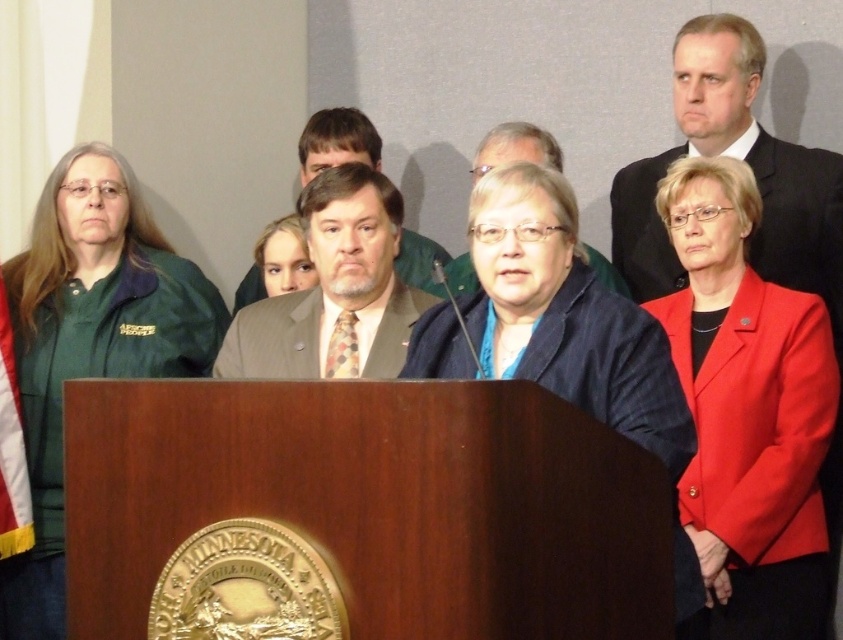
Does point (696, 220) lie in front of point (603, 285)?

No.

Can you confirm if matte red blazer at right is wider than blue fabric jacket at center?

In fact, matte red blazer at right might be narrower than blue fabric jacket at center.

Between point (781, 468) and point (643, 374), which one is positioned behind?

Point (781, 468)

This screenshot has height=640, width=843. What are the coordinates of `matte red blazer at right` in the screenshot? It's located at (747, 410).

Between matte red blazer at right and dark suit at upper right, which one has more height?

matte red blazer at right is taller.

This screenshot has width=843, height=640. What do you see at coordinates (747, 410) in the screenshot?
I see `matte red blazer at right` at bounding box center [747, 410].

The height and width of the screenshot is (640, 843). Find the location of `matte red blazer at right`. matte red blazer at right is located at coordinates (747, 410).

Does matte red blazer at right have a smaller size compared to light brown suit at center?

Actually, matte red blazer at right might be larger than light brown suit at center.

Can you confirm if matte red blazer at right is taller than light brown suit at center?

Indeed, matte red blazer at right has a greater height compared to light brown suit at center.

This screenshot has width=843, height=640. In order to click on matte red blazer at right in this screenshot , I will do `click(747, 410)`.

Locate an element on the screen. The width and height of the screenshot is (843, 640). matte red blazer at right is located at coordinates (x=747, y=410).